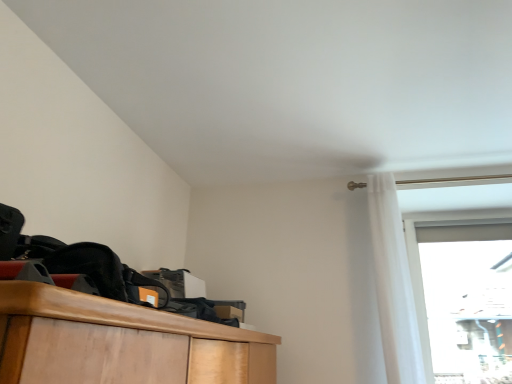
Find the location of a particular element. The width and height of the screenshot is (512, 384). transparent glass door at upper right is located at coordinates (466, 301).

Based on the photo, in order to face transparent glass door at upper right, should I rotate leftwards or rightwards?

To face it directly, rotate right by 27.100 degrees.

What do you see at coordinates (466, 301) in the screenshot?
I see `transparent glass door at upper right` at bounding box center [466, 301].

Measure the distance between transparent glass door at upper right and camera.

transparent glass door at upper right is 8.18 feet from camera.

Locate an element on the screen. The image size is (512, 384). white sheer curtain at upper right is located at coordinates (394, 284).

This screenshot has width=512, height=384. Describe the element at coordinates (394, 284) in the screenshot. I see `white sheer curtain at upper right` at that location.

Find the location of `transparent glass door at upper right`. transparent glass door at upper right is located at coordinates (466, 301).

Can you confirm if white sheer curtain at upper right is positioned to the left of transparent glass door at upper right?

Yes.

Which object is further away from the camera, white sheer curtain at upper right or transparent glass door at upper right?

transparent glass door at upper right is more distant.

Between point (409, 300) and point (490, 322), which one is positioned behind?

The point (490, 322) is more distant.

From the image's perspective, is white sheer curtain at upper right over transparent glass door at upper right?

Yes, from the image's perspective, white sheer curtain at upper right is over transparent glass door at upper right.

Looking at this image, from a real-world perspective, does white sheer curtain at upper right stand above transparent glass door at upper right?

Yes, from a real-world perspective, white sheer curtain at upper right is over transparent glass door at upper right

Can you confirm if white sheer curtain at upper right is thinner than transparent glass door at upper right?

Incorrect, the width of white sheer curtain at upper right is not less than that of transparent glass door at upper right.

Is white sheer curtain at upper right taller or shorter than transparent glass door at upper right?

In the image, white sheer curtain at upper right appears to be taller than transparent glass door at upper right.

Does white sheer curtain at upper right have a larger size compared to transparent glass door at upper right?

Yes, white sheer curtain at upper right is bigger than transparent glass door at upper right.

Is white sheer curtain at upper right completely or partially outside of transparent glass door at upper right?

Yes.

Consider the image. Is white sheer curtain at upper right far away from transparent glass door at upper right?

No, white sheer curtain at upper right is not far from transparent glass door at upper right.

Is white sheer curtain at upper right facing towards transparent glass door at upper right?

No, white sheer curtain at upper right is not aimed at transparent glass door at upper right.

How many degrees apart are the facing directions of white sheer curtain at upper right and transparent glass door at upper right?

white sheer curtain at upper right and transparent glass door at upper right are facing 1.04 degrees away from each other.

Measure the distance between white sheer curtain at upper right and transparent glass door at upper right.

white sheer curtain at upper right is 27.57 inches from transparent glass door at upper right.

Where is `curtain above the transparent glass door at upper right (from the image's perspective)`? curtain above the transparent glass door at upper right (from the image's perspective) is located at coordinates (394, 284).

Consider the image. Is transparent glass door at upper right to the left of white sheer curtain at upper right from the viewer's perspective?

No, transparent glass door at upper right is not to the left of white sheer curtain at upper right.

Which is in front, transparent glass door at upper right or white sheer curtain at upper right?

Positioned in front is white sheer curtain at upper right.

Considering the points (499, 305) and (421, 358), which point is behind, point (499, 305) or point (421, 358)?

Point (499, 305)

From the image's perspective, is transparent glass door at upper right located above or below white sheer curtain at upper right?

Clearly, from the image's perspective, transparent glass door at upper right is below white sheer curtain at upper right.

From a real-world perspective, which object stands above the other?

In real-world perspective, white sheer curtain at upper right is above.

Is transparent glass door at upper right wider than white sheer curtain at upper right?

Incorrect, the width of transparent glass door at upper right does not surpass that of white sheer curtain at upper right.

Considering the relative sizes of transparent glass door at upper right and white sheer curtain at upper right in the image provided, is transparent glass door at upper right taller than white sheer curtain at upper right?

Result: Incorrect, the height of transparent glass door at upper right is not larger of that of white sheer curtain at upper right.

Who is smaller, transparent glass door at upper right or white sheer curtain at upper right?

transparent glass door at upper right.

Is transparent glass door at upper right outside of white sheer curtain at upper right?

Yes, transparent glass door at upper right is outside of white sheer curtain at upper right.

Is transparent glass door at upper right far away from white sheer curtain at upper right?

→ Actually, transparent glass door at upper right and white sheer curtain at upper right are a little close together.

Looking at this image, is transparent glass door at upper right oriented away from white sheer curtain at upper right?

No, transparent glass door at upper right's orientation is not away from white sheer curtain at upper right.

Can you tell me how much transparent glass door at upper right and white sheer curtain at upper right differ in facing direction?

transparent glass door at upper right and white sheer curtain at upper right are facing 1.04 degrees away from each other.

In order to click on curtain above the transparent glass door at upper right (from a real-world perspective) in this screenshot , I will do `click(394, 284)`.

I want to click on curtain on the left side of transparent glass door at upper right, so click(x=394, y=284).

Where is `curtain lying above the transparent glass door at upper right (from the image's perspective)`? The image size is (512, 384). curtain lying above the transparent glass door at upper right (from the image's perspective) is located at coordinates coord(394,284).